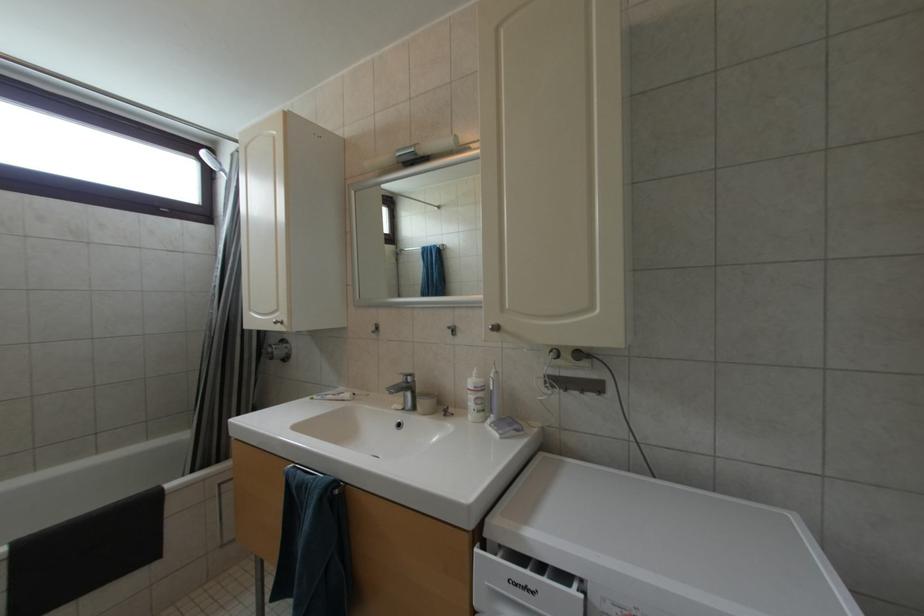
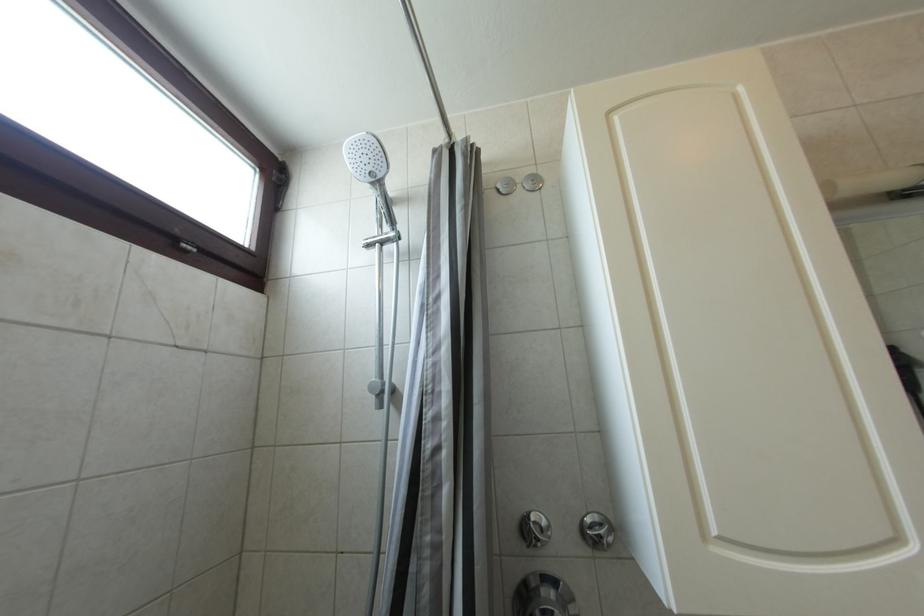
In a continuous first-person perspective shot, in which direction is the camera moving?

The cameraman walked toward left, forward.